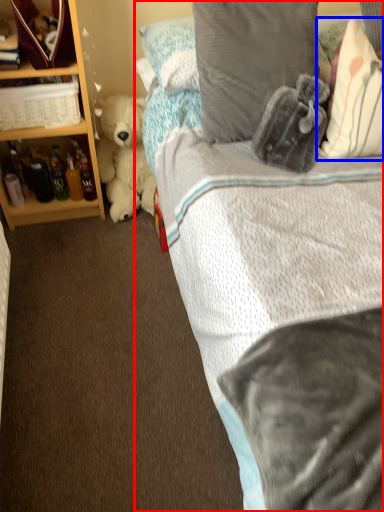
Question: Which point is closer to the camera, bed (highlighted by a red box) or pillow (highlighted by a blue box)?

Choices:
 (A) bed
 (B) pillow

Answer: (A)